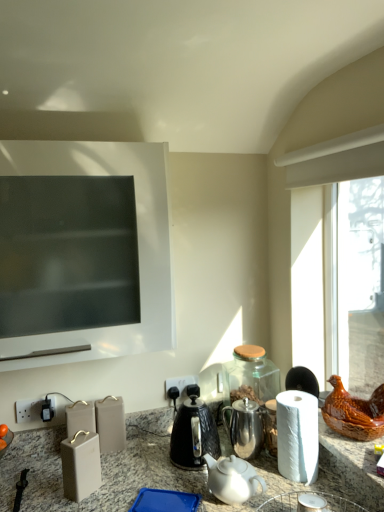
Question: Is white ceramic teapot at center a part of matte gray knife block at center?

Choices:
 (A) yes
 (B) no

Answer: (B)

Question: Is matte gray knife block at center placed right next to white ceramic teapot at center?

Choices:
 (A) yes
 (B) no

Answer: (B)

Question: Is matte gray knife block at center closer to camera compared to white ceramic teapot at center?

Choices:
 (A) yes
 (B) no

Answer: (B)

Question: Can you confirm if matte gray knife block at center is bigger than white ceramic teapot at center?

Choices:
 (A) yes
 (B) no

Answer: (A)

Question: Is matte gray knife block at center wider than white ceramic teapot at center?

Choices:
 (A) no
 (B) yes

Answer: (A)

Question: Does matte gray knife block at center have a lesser height compared to white ceramic teapot at center?

Choices:
 (A) no
 (B) yes

Answer: (A)

Question: Is white ceramic teapot at center surrounding white paper at right?

Choices:
 (A) yes
 (B) no

Answer: (B)

Question: Is white ceramic teapot at center further to camera compared to white paper at right?

Choices:
 (A) yes
 (B) no

Answer: (B)

Question: Considering the relative sizes of white ceramic teapot at center and white paper at right in the image provided, is white ceramic teapot at center bigger than white paper at right?

Choices:
 (A) yes
 (B) no

Answer: (B)

Question: Is white ceramic teapot at center next to white paper at right?

Choices:
 (A) no
 (B) yes

Answer: (A)

Question: Considering the relative sizes of white ceramic teapot at center and white paper at right in the image provided, is white ceramic teapot at center smaller than white paper at right?

Choices:
 (A) no
 (B) yes

Answer: (B)

Question: From a real-world perspective, is white ceramic teapot at center below white paper at right?

Choices:
 (A) no
 (B) yes

Answer: (B)

Question: Considering the relative sizes of shiny metallic teapot at center and black plastic electric outlet at lower center in the image provided, is shiny metallic teapot at center smaller than black plastic electric outlet at lower center?

Choices:
 (A) no
 (B) yes

Answer: (A)